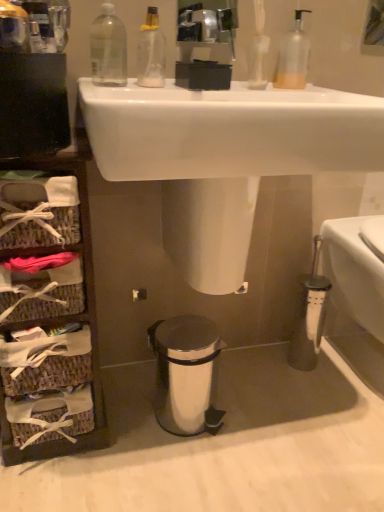
Question: Is white glossy toilet bowl at right smaller than transparent plastic bottle at upper center, arranged as the 2th cleaning product when viewed from the right?

Choices:
 (A) no
 (B) yes

Answer: (A)

Question: Considering the relative sizes of white glossy toilet bowl at right and transparent plastic bottle at upper center, the first cleaning product positioned from the left, in the image provided, is white glossy toilet bowl at right thinner than transparent plastic bottle at upper center, the first cleaning product positioned from the left,?

Choices:
 (A) no
 (B) yes

Answer: (A)

Question: Is transparent plastic bottle at upper center, the first cleaning product positioned from the left, inside white glossy toilet bowl at right?

Choices:
 (A) yes
 (B) no

Answer: (B)

Question: From the image's perspective, is white glossy toilet bowl at right on transparent plastic bottle at upper center, arranged as the 2th cleaning product when viewed from the right?

Choices:
 (A) no
 (B) yes

Answer: (A)

Question: Is white glossy toilet bowl at right touching transparent plastic bottle at upper center, arranged as the 2th cleaning product when viewed from the right?

Choices:
 (A) no
 (B) yes

Answer: (A)

Question: Is white glossy sink at upper center bigger or smaller than white glossy toilet bowl at right?

Choices:
 (A) big
 (B) small

Answer: (A)

Question: Looking at their shapes, would you say white glossy sink at upper center is wider or thinner than white glossy toilet bowl at right?

Choices:
 (A) thin
 (B) wide

Answer: (B)

Question: From a real-world perspective, is white glossy sink at upper center above or below white glossy toilet bowl at right?

Choices:
 (A) above
 (B) below

Answer: (A)

Question: Choose the correct answer: Is white glossy sink at upper center inside white glossy toilet bowl at right or outside it?

Choices:
 (A) inside
 (B) outside

Answer: (B)

Question: Would you say white glossy sink at upper center is to the left or to the right of woven brown basket at left in the picture?

Choices:
 (A) right
 (B) left

Answer: (A)

Question: Considering the positions of point (297, 117) and point (97, 371), is point (297, 117) closer or farther from the camera than point (97, 371)?

Choices:
 (A) farther
 (B) closer

Answer: (B)

Question: From a real-world perspective, is white glossy sink at upper center positioned above or below woven brown basket at left?

Choices:
 (A) above
 (B) below

Answer: (A)

Question: Do you think white glossy sink at upper center is within woven brown basket at left, or outside of it?

Choices:
 (A) outside
 (B) inside

Answer: (A)

Question: Is translucent plastic soap dispenser at upper center, acting as the first cleaning product starting from the right, bigger or smaller than clear plastic bottle at upper left?

Choices:
 (A) big
 (B) small

Answer: (B)

Question: Is translucent plastic soap dispenser at upper center, acting as the first cleaning product starting from the right, wider or thinner than clear plastic bottle at upper left?

Choices:
 (A) thin
 (B) wide

Answer: (A)